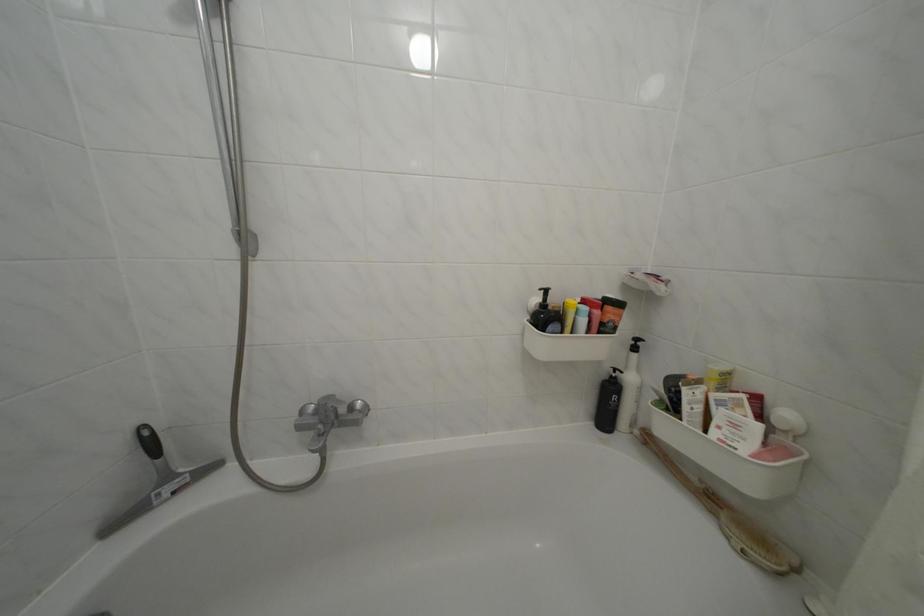
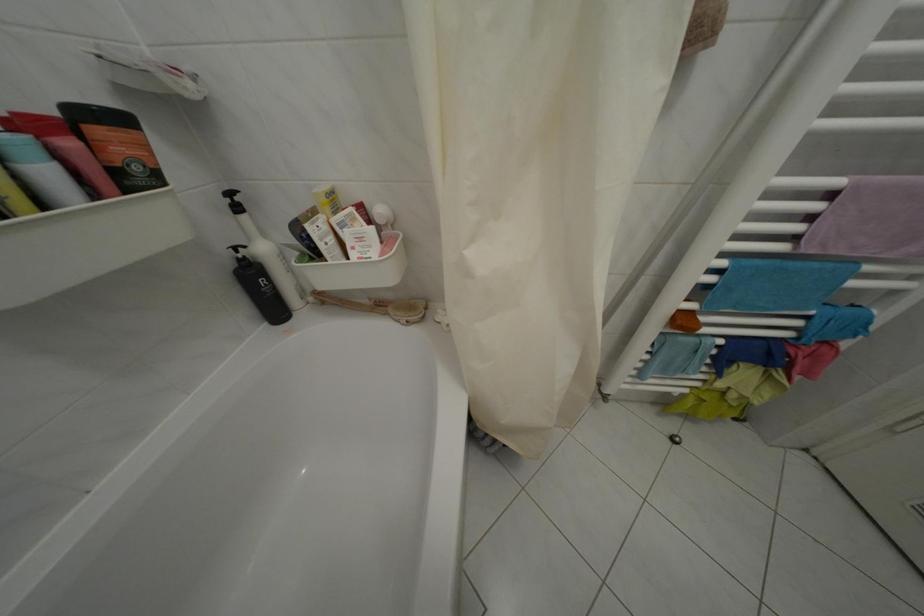
The point at (630, 379) is marked in the first image. Where is the corresponding point in the second image?

(253, 254)